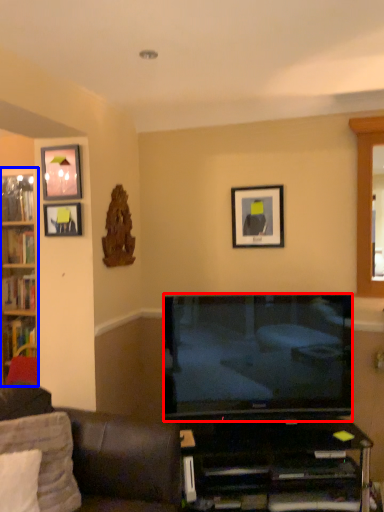
Question: Among these objects, which one is nearest to the camera, television (highlighted by a red box) or cabinetry (highlighted by a blue box)?

Choices:
 (A) television
 (B) cabinetry

Answer: (A)